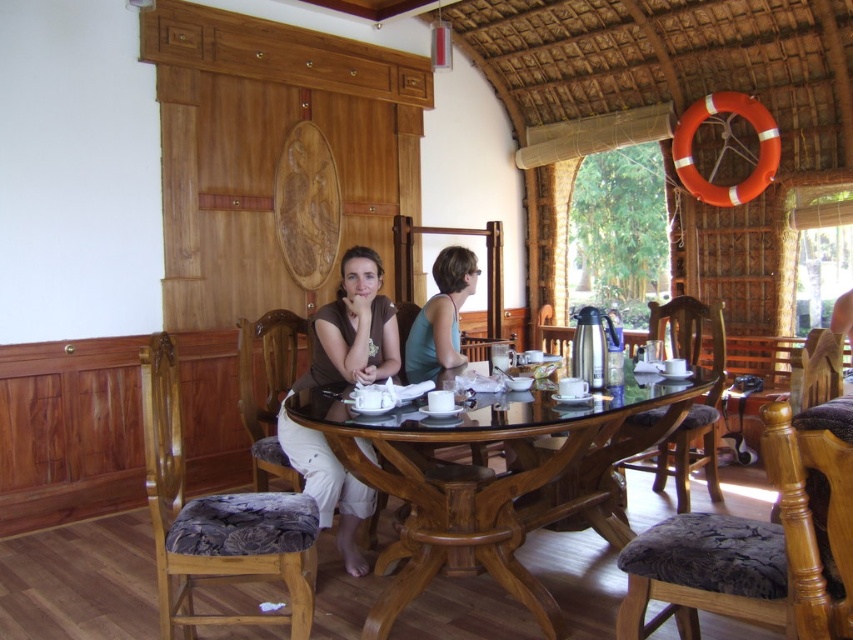
Question: Is mahogany wood table at center bigger than brown fabric pants at center?

Choices:
 (A) yes
 (B) no

Answer: (A)

Question: Is mahogany wood table at center positioned in front of brown fabric pants at center?

Choices:
 (A) no
 (B) yes

Answer: (B)

Question: Which point is closer to the camera?

Choices:
 (A) (575, 474)
 (B) (329, 484)

Answer: (B)

Question: Does mahogany wood table at center have a larger size compared to brown fabric pants at center?

Choices:
 (A) yes
 (B) no

Answer: (A)